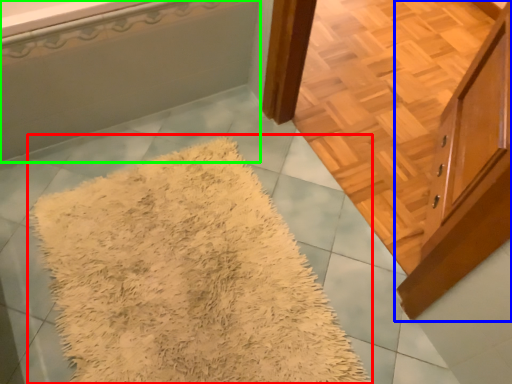
Question: Which object is the closest to the mat (highlighted by a red box)? Choose among these: cabinetry (highlighted by a blue box) or bathtub (highlighted by a green box).

Choices:
 (A) cabinetry
 (B) bathtub

Answer: (B)